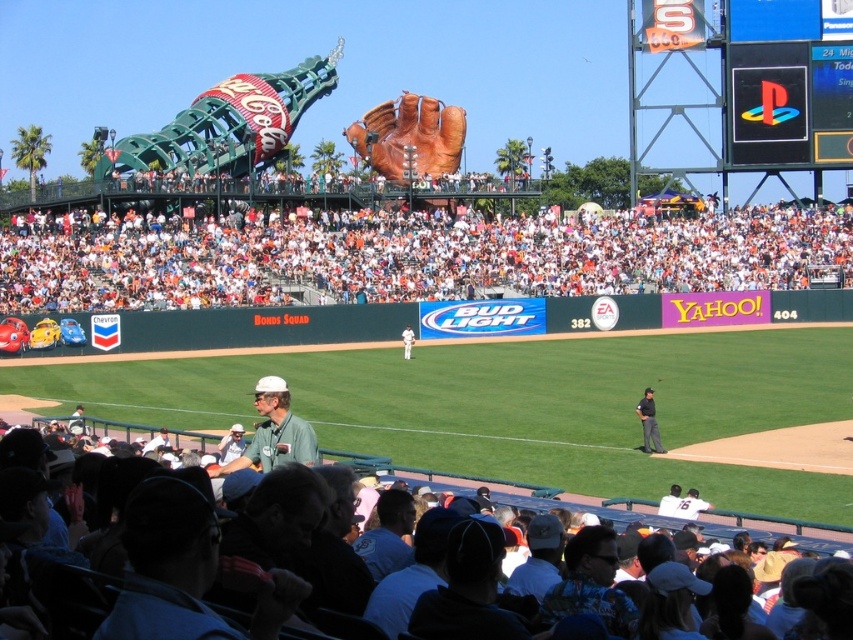
Question: Is light blue shirt at lower center below white baseball cap at center?

Choices:
 (A) yes
 (B) no

Answer: (A)

Question: Is green matte shirt at center above light blue shirt at lower center?

Choices:
 (A) yes
 (B) no

Answer: (A)

Question: Which of these objects is positioned closest to the white fabric crowd at upper center?

Choices:
 (A) black fabric shirt at center
 (B) green matte shirt at center
 (C) shiny plastic sign at upper right

Answer: (C)

Question: Which of these objects is positioned closest to the brown leather baseball glove at center?

Choices:
 (A) camouflage shirt at lower center
 (B) white baseball cap at center

Answer: (B)

Question: Does camouflage shirt at lower center have a smaller size compared to black fabric shirt at center?

Choices:
 (A) yes
 (B) no

Answer: (A)

Question: Which is farther from the green matte shirt at center?

Choices:
 (A) black fabric shirt at center
 (B) camouflage shirt at lower center
 (C) white baseball cap at center

Answer: (C)